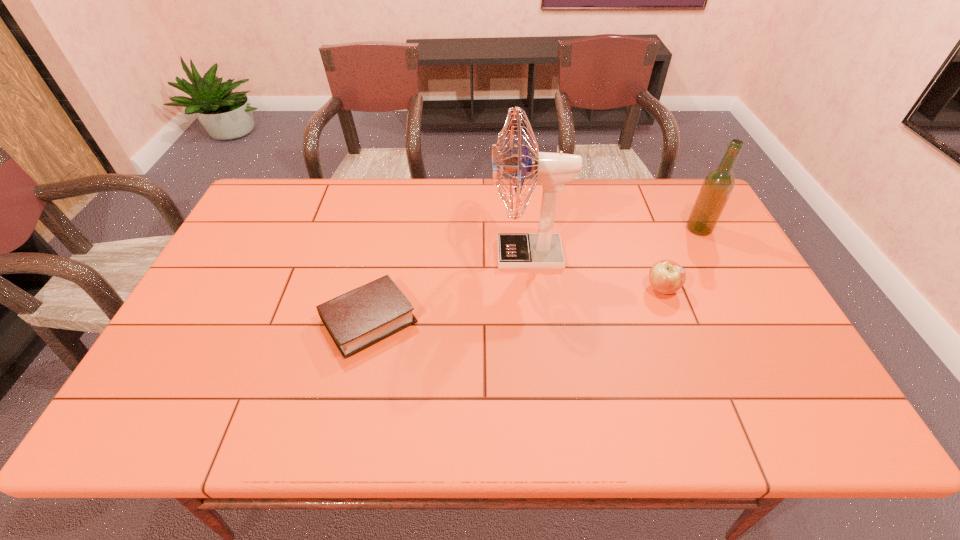
I want to click on free space located on the front-facing side of the third object from right to left, so click(x=367, y=254).

Locate an element on the screen. The height and width of the screenshot is (540, 960). vacant space located on the back of the liquor is located at coordinates (677, 188).

This screenshot has height=540, width=960. What are the coordinates of `vacant point located 0.050m on the right of the third tallest object` in the screenshot? It's located at (697, 289).

Image resolution: width=960 pixels, height=540 pixels. In order to click on free location located 0.080m on the back of the Bible in this screenshot , I will do point(381,266).

Where is `object located at the far edge`? object located at the far edge is located at coordinates (718, 185).

Where is `object situated at the right edge`? The height and width of the screenshot is (540, 960). object situated at the right edge is located at coordinates (718, 185).

The image size is (960, 540). Identify the location of object that is at the far right corner. (718, 185).

Image resolution: width=960 pixels, height=540 pixels. What are the coordinates of `vacant space at the far edge of the desktop` in the screenshot? It's located at (584, 181).

You are a GUI agent. You are given a task and a screenshot of the screen. Output one action in this format:
    pyautogui.click(x=<x>, y=<y>)
    Task: Click on the free region at the near edge of the desktop
    
    Given the screenshot: What is the action you would take?
    pyautogui.click(x=524, y=418)

Where is `free space at the left edge of the desktop`? The width and height of the screenshot is (960, 540). free space at the left edge of the desktop is located at coordinates (218, 340).